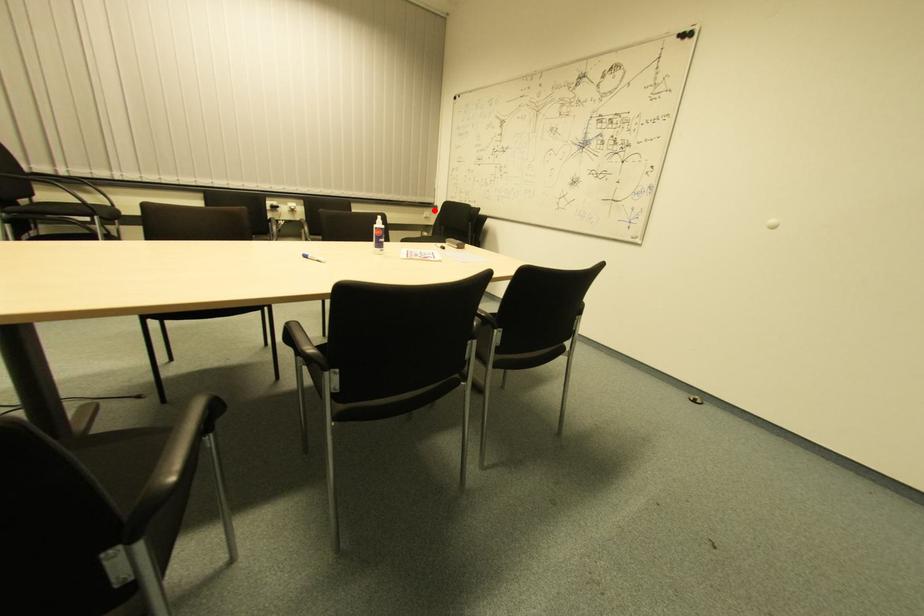
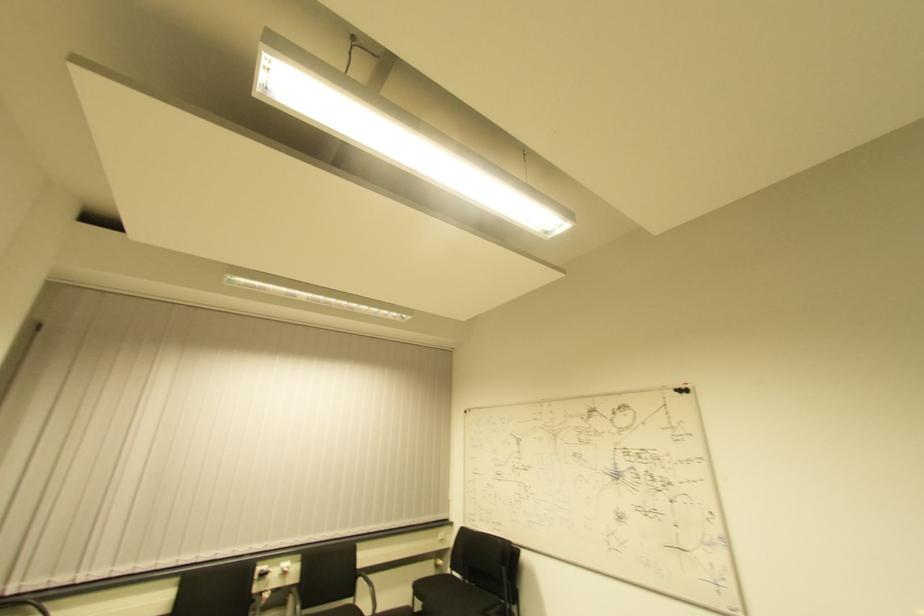
Where in the second image is the point corresponding to the highlighted location from the first image?

(450, 527)